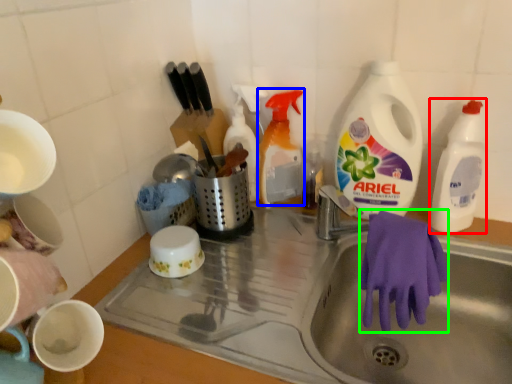
Question: Considering the real-world distances, which object is farthest from cleaning product (highlighted by a red box)? cleaning product (highlighted by a blue box) or glove (highlighted by a green box)?

Choices:
 (A) cleaning product
 (B) glove

Answer: (A)